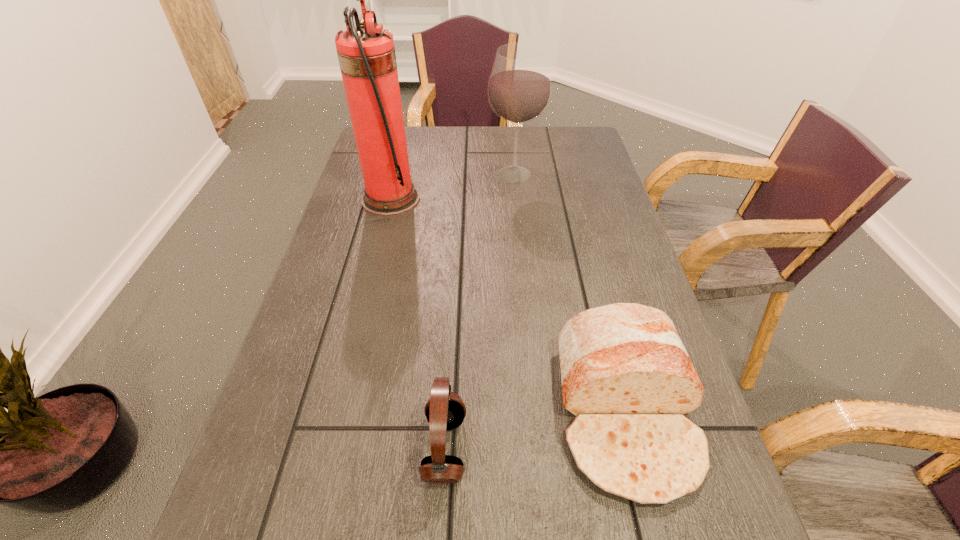
Identify the location of the leftmost object. This screenshot has width=960, height=540. (366, 54).

Find the location of a particular element. The height and width of the screenshot is (540, 960). fire extinguisher is located at coordinates (366, 54).

You are a GUI agent. You are given a task and a screenshot of the screen. Output one action in this format:
    pyautogui.click(x=<x>, y=<y>)
    Task: Click on the second tallest object
    
    Given the screenshot: What is the action you would take?
    pyautogui.click(x=519, y=88)

The image size is (960, 540). Find the location of `the third object from right to left`. the third object from right to left is located at coordinates (445, 410).

Identify the location of bread. This screenshot has width=960, height=540. (625, 374).

Find the location of a particular element. vacant space positioned at the discharge end of the tallest object is located at coordinates (539, 199).

Find the location of a particular element. The image size is (960, 540). free spot located on the front of the third shortest object is located at coordinates (520, 238).

The height and width of the screenshot is (540, 960). Identify the location of free space located on the ear pads of the second object from left to right. 550,448.

Where is `object located at the far edge`? object located at the far edge is located at coordinates (519, 88).

The image size is (960, 540). Find the location of `object located at the left edge`. object located at the left edge is located at coordinates (366, 54).